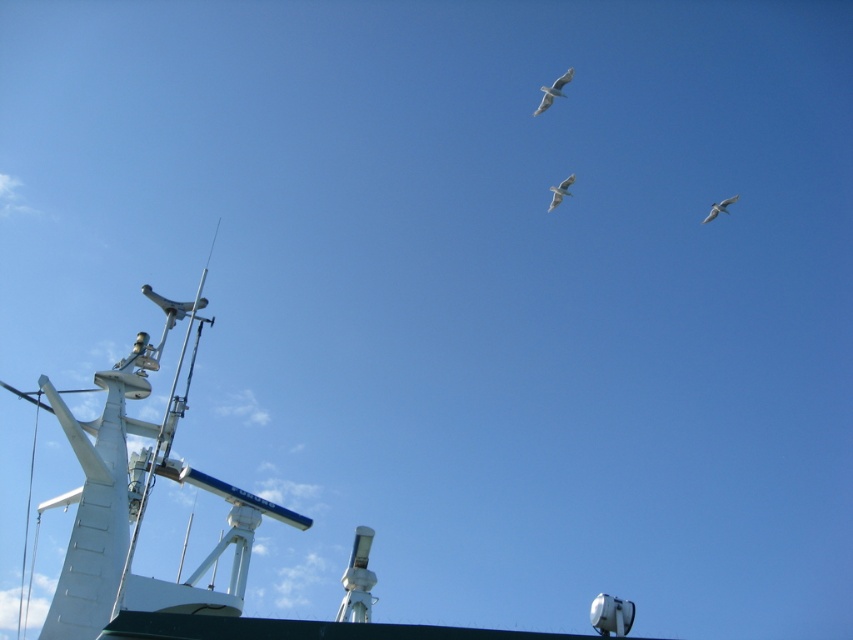
Is white feathered bird at upper center smaller than white feathered bird at upper right?

No.

Who is higher up, white feathered bird at upper center or white feathered bird at upper right?

white feathered bird at upper center is higher up.

Locate an element on the screen. The height and width of the screenshot is (640, 853). white feathered bird at upper center is located at coordinates (553, 90).

Does white matte radar at upper left have a greater height compared to white feathered bird at center?

Yes, white matte radar at upper left is taller than white feathered bird at center.

Is white matte radar at upper left closer to the viewer compared to white feathered bird at center?

Yes.

The height and width of the screenshot is (640, 853). I want to click on white matte radar at upper left, so click(144, 508).

This screenshot has width=853, height=640. What are the coordinates of `white matte radar at upper left` in the screenshot? It's located at (144, 508).

Is white matte radar at upper left bigger than white feathered bird at upper right?

Indeed, white matte radar at upper left has a larger size compared to white feathered bird at upper right.

Can you confirm if white matte radar at upper left is taller than white feathered bird at upper right?

Yes, white matte radar at upper left is taller than white feathered bird at upper right.

Which is in front, point (567, 636) or point (712, 208)?

Point (567, 636)

The image size is (853, 640). Find the location of `white matte radar at upper left`. white matte radar at upper left is located at coordinates (144, 508).